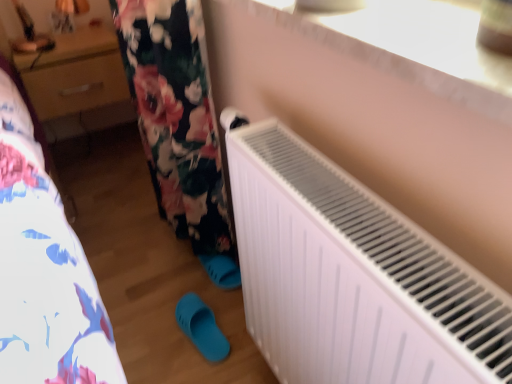
What do you see at coordinates (76, 85) in the screenshot? I see `wooden drawer at upper left` at bounding box center [76, 85].

I want to click on wooden drawer at upper left, so click(76, 85).

The height and width of the screenshot is (384, 512). Describe the element at coordinates (201, 327) in the screenshot. I see `matte plastic slipper at lower center` at that location.

Measure the distance between white matte radiator at lower right and camera.

15.66 inches.

Where is `wooden drawer at upper left`? wooden drawer at upper left is located at coordinates (76, 85).

Choose the correct answer: Is white matte radiator at lower right inside white plastic radiator at upper right or outside it?

white matte radiator at lower right lies outside white plastic radiator at upper right.

Could you tell me if white matte radiator at lower right is turned towards white plastic radiator at upper right?

No, white matte radiator at lower right is not turned towards white plastic radiator at upper right.

Which is closer, (344, 176) or (429, 18)?

Point (429, 18)

In terms of width, does wooden drawer at upper left look wider or thinner when compared to matte plastic slipper at lower center?

wooden drawer at upper left is wider than matte plastic slipper at lower center.

Does wooden drawer at upper left have a larger size compared to matte plastic slipper at lower center?

Correct, wooden drawer at upper left is larger in size than matte plastic slipper at lower center.

From the image's perspective, is wooden drawer at upper left above matte plastic slipper at lower center?

Indeed, from the image's perspective, wooden drawer at upper left is shown above matte plastic slipper at lower center.

Between wooden drawer at upper left and matte plastic slipper at lower center, which one appears on the right side from the viewer's perspective?

matte plastic slipper at lower center is more to the right.

Is point (455, 42) positioned in front of point (291, 189)?

Yes.

Locate an element on the screen. radiator that appears behind the white plastic radiator at upper right is located at coordinates (352, 275).

Is white plastic radiator at upper right placed right next to white matte radiator at lower right?

No, white plastic radiator at upper right is not in contact with white matte radiator at lower right.

From the image's perspective, which object appears higher, white plastic radiator at upper right or white matte radiator at lower right?

From the image's view, white plastic radiator at upper right is above.

Between matte plastic slipper at lower center and white matte radiator at lower right, which one appears on the left side from the viewer's perspective?

From the viewer's perspective, matte plastic slipper at lower center appears more on the left side.

Considering the relative sizes of matte plastic slipper at lower center and white matte radiator at lower right in the image provided, is matte plastic slipper at lower center bigger than white matte radiator at lower right?

No.

Between matte plastic slipper at lower center and white matte radiator at lower right, which one has less height?

matte plastic slipper at lower center.

From a real-world perspective, between wooden drawer at upper left and white plastic radiator at upper right, who is vertically lower?

From a 3D spatial view, wooden drawer at upper left is below.

Identify the location of drawer below the white plastic radiator at upper right (from a real-world perspective). (76, 85).

Can you tell me how much wooden drawer at upper left and white plastic radiator at upper right differ in facing direction?

The facing directions of wooden drawer at upper left and white plastic radiator at upper right are 89.9 degrees apart.

Are wooden drawer at upper left and white plastic radiator at upper right far apart?

Yes, wooden drawer at upper left and white plastic radiator at upper right are quite far apart.

Can you confirm if white plastic radiator at upper right is wider than matte plastic slipper at lower center?

Yes.

Considering their positions, is white plastic radiator at upper right located in front of or behind matte plastic slipper at lower center?

white plastic radiator at upper right is in front of matte plastic slipper at lower center.

Is white plastic radiator at upper right completely or partially outside of matte plastic slipper at lower center?

white plastic radiator at upper right is positioned outside matte plastic slipper at lower center.

Looking at their sizes, would you say wooden drawer at upper left is wider or thinner than white matte radiator at lower right?

wooden drawer at upper left is wider than white matte radiator at lower right.

From the image's perspective, who appears lower, wooden drawer at upper left or white matte radiator at lower right?

white matte radiator at lower right.

Measure the distance between wooden drawer at upper left and white matte radiator at lower right.

The distance of wooden drawer at upper left from white matte radiator at lower right is 1.35 meters.

Is wooden drawer at upper left at the left side of white matte radiator at lower right?

Indeed, wooden drawer at upper left is positioned on the left side of white matte radiator at lower right.

Find the location of a particular element. window sill above the white matte radiator at lower right (from the image's perspective) is located at coordinates (426, 37).

Where is `footwear below the wooden drawer at upper left (from a real-world perspective)`? The width and height of the screenshot is (512, 384). footwear below the wooden drawer at upper left (from a real-world perspective) is located at coordinates (201, 327).

Considering their positions, is wooden drawer at upper left positioned further to white plastic radiator at upper right than white matte radiator at lower right?

wooden drawer at upper left lies further to white plastic radiator at upper right than the other object.

When comparing their distances from wooden drawer at upper left, does white plastic radiator at upper right or matte plastic slipper at lower center seem closer?

matte plastic slipper at lower center.

When comparing their distances from white matte radiator at lower right, does matte plastic slipper at lower center or wooden drawer at upper left seem closer?

matte plastic slipper at lower center lies closer to white matte radiator at lower right than the other object.

Based on their spatial positions, is white matte radiator at lower right or matte plastic slipper at lower center further from white plastic radiator at upper right?

Among the two, matte plastic slipper at lower center is located further to white plastic radiator at upper right.

Based on their spatial positions, is wooden drawer at upper left or matte plastic slipper at lower center further from white plastic radiator at upper right?

Among the two, wooden drawer at upper left is located further to white plastic radiator at upper right.

From the picture: Considering their positions, is white plastic radiator at upper right positioned closer to matte plastic slipper at lower center than white matte radiator at lower right?

white matte radiator at lower right is positioned closer to the anchor matte plastic slipper at lower center.

From the image, which object appears to be farther from white matte radiator at lower right, wooden drawer at upper left or matte plastic slipper at lower center?

wooden drawer at upper left is positioned further to the anchor white matte radiator at lower right.

Estimate the real-world distances between objects in this image. Which object is further from wooden drawer at upper left, matte plastic slipper at lower center or white plastic radiator at upper right?

white plastic radiator at upper right.

Find the location of a particular element. The height and width of the screenshot is (384, 512). radiator between white plastic radiator at upper right and matte plastic slipper at lower center from front to back is located at coordinates (352, 275).

The image size is (512, 384). In order to click on footwear between white matte radiator at lower right and wooden drawer at upper left from front to back in this screenshot , I will do `click(201, 327)`.

I want to click on footwear between white plastic radiator at upper right and wooden drawer at upper left along the z-axis, so [x=201, y=327].

Where is `radiator between white plastic radiator at upper right and wooden drawer at upper left along the z-axis`? radiator between white plastic radiator at upper right and wooden drawer at upper left along the z-axis is located at coordinates (352, 275).